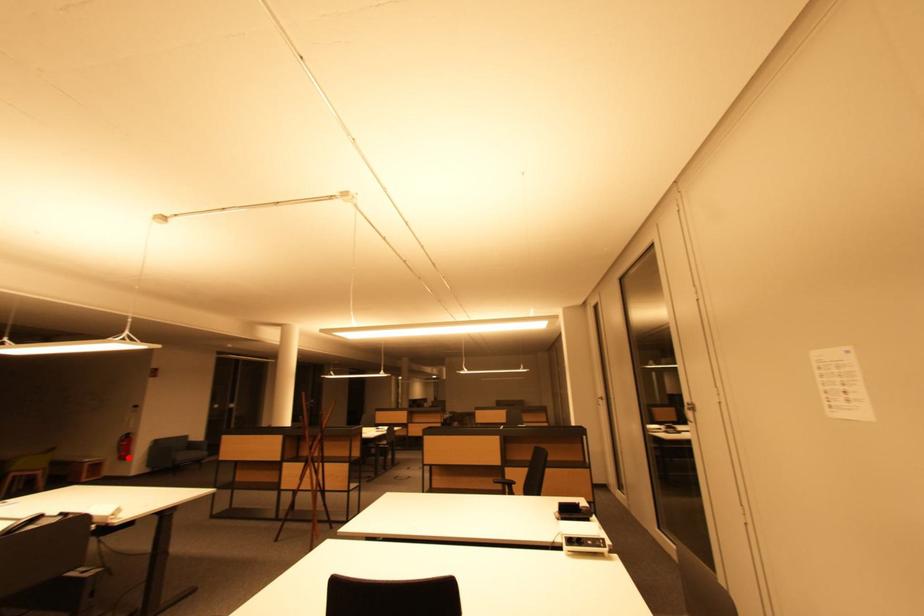
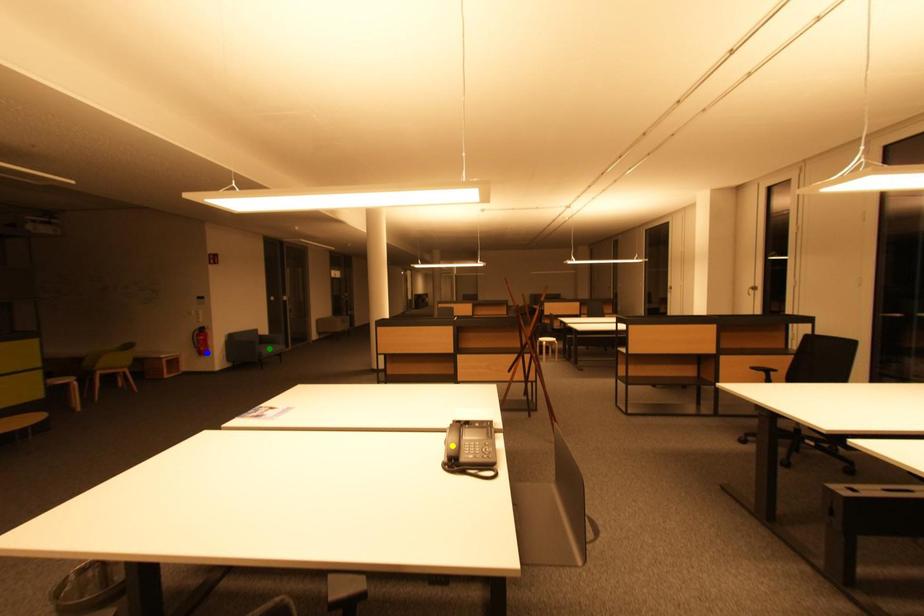
Question: I am providing you with two images of the same scene from different viewpoints. A red point is marked on the first image. You are given multiple points on the second image. Which point in image 2 represents the same 3d spot as the red point in image 1?

Choices:
 (A) blue point
 (B) green point
 (C) yellow point

Answer: (A)